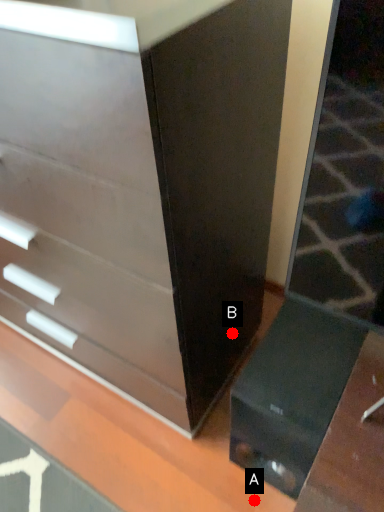
Question: Two points are circled on the image, labeled by A and B beside each circle. Which point is closer to the camera?

Choices:
 (A) A is closer
 (B) B is closer

Answer: (A)